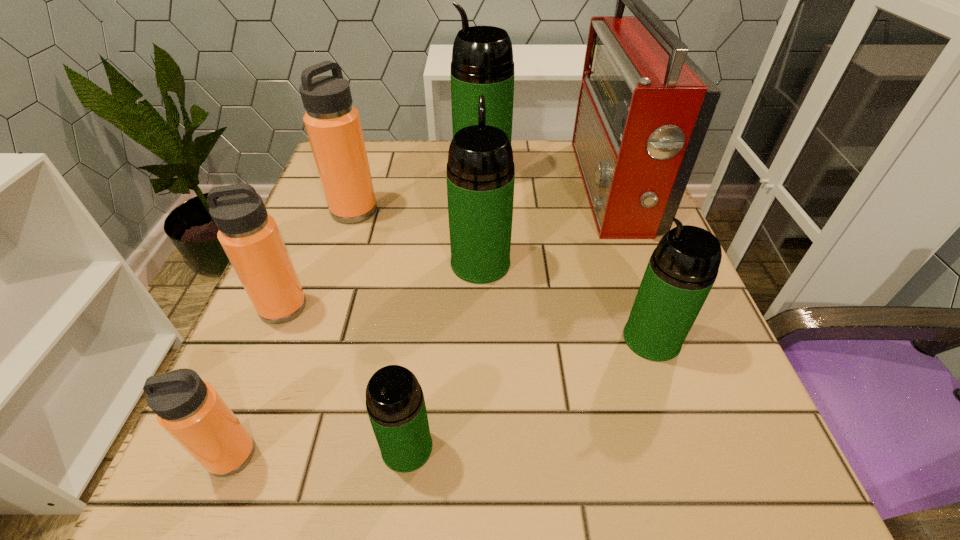
The width and height of the screenshot is (960, 540). Find the location of `vacant area situated from the spout of the second biggest green thermos bottle`. vacant area situated from the spout of the second biggest green thermos bottle is located at coordinates (480, 166).

Locate an element on the screen. vacant region located on the front of the farthest orange thermos bottle is located at coordinates (295, 388).

Locate an element on the screen. vacant space located on the back of the second biggest orange thermos bottle is located at coordinates (326, 204).

The image size is (960, 540). I want to click on vacant area located 0.130m from the spout of the second smallest green thermos bottle, so click(541, 339).

The height and width of the screenshot is (540, 960). What are the coordinates of `vacant space positioned 0.290m from the spout of the second smallest green thermos bottle` in the screenshot? It's located at (442, 339).

The height and width of the screenshot is (540, 960). In order to click on vacant space situated from the spout of the second smallest green thermos bottle in this screenshot , I will do `click(567, 339)`.

Find the location of a particular element. vacant space situated on the back of the smallest orange thermos bottle is located at coordinates (317, 244).

Find the location of a particular element. This screenshot has width=960, height=540. thermos bottle present at the far edge is located at coordinates (482, 63).

Where is `radio receiver that is at the far edge`? The width and height of the screenshot is (960, 540). radio receiver that is at the far edge is located at coordinates click(644, 108).

I want to click on radio receiver located in the right edge section of the desktop, so click(644, 108).